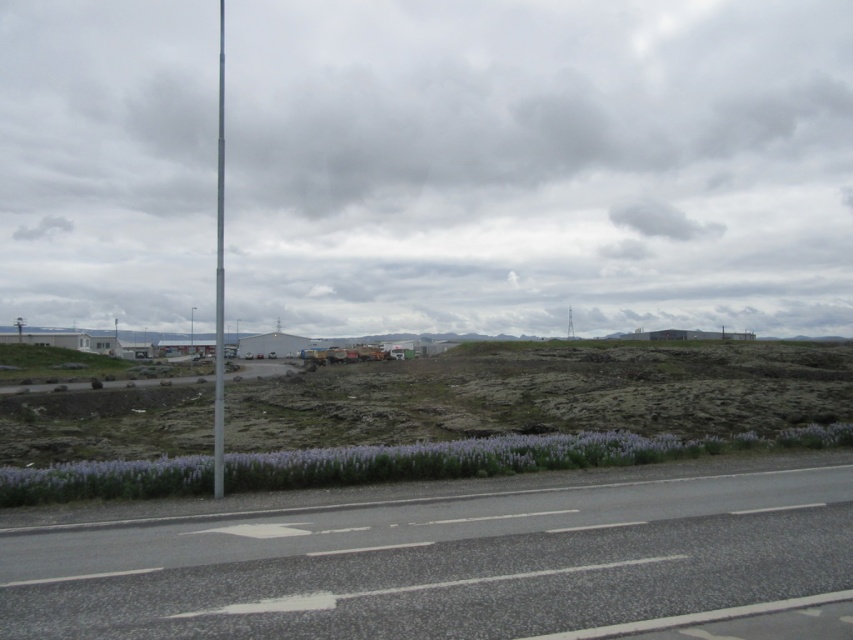
Does gray asphalt highway at lower center appear over metallic pole at left?

No, gray asphalt highway at lower center is not above metallic pole at left.

Is gray asphalt highway at lower center taller than metallic pole at left?

No.

Between point (276, 584) and point (219, 132), which one is positioned in front?

Point (276, 584)

Locate an element on the screen. This screenshot has height=640, width=853. gray asphalt highway at lower center is located at coordinates (440, 563).